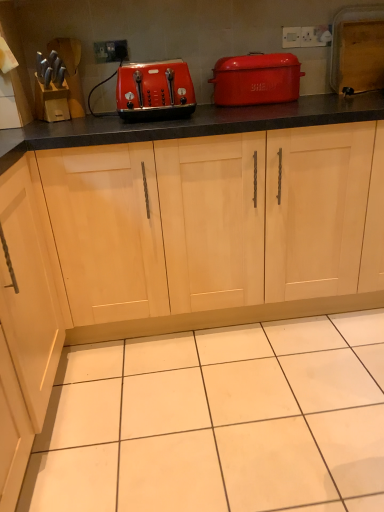
Question: From a real-world perspective, is light wood cabinet at center physically above matte red bread bin at upper center?

Choices:
 (A) no
 (B) yes

Answer: (A)

Question: Can you confirm if light wood cabinet at center is wider than matte red bread bin at upper center?

Choices:
 (A) no
 (B) yes

Answer: (B)

Question: Is the surface of light wood cabinet at center in direct contact with matte red bread bin at upper center?

Choices:
 (A) no
 (B) yes

Answer: (A)

Question: Are light wood cabinet at center and matte red bread bin at upper center far apart?

Choices:
 (A) yes
 (B) no

Answer: (B)

Question: From the image's perspective, would you say light wood cabinet at center is shown under matte red bread bin at upper center?

Choices:
 (A) yes
 (B) no

Answer: (A)

Question: Considering the relative positions of light wood cabinet at center and matte red bread bin at upper center in the image provided, is light wood cabinet at center to the left of matte red bread bin at upper center from the viewer's perspective?

Choices:
 (A) yes
 (B) no

Answer: (A)

Question: Could you tell me if white plastic electric outlet at upper center is turned towards matte red bread bin at upper center?

Choices:
 (A) no
 (B) yes

Answer: (A)

Question: From a real-world perspective, is white plastic electric outlet at upper center located higher than matte red bread bin at upper center?

Choices:
 (A) no
 (B) yes

Answer: (B)

Question: From a real-world perspective, is white plastic electric outlet at upper center positioned under matte red bread bin at upper center based on gravity?

Choices:
 (A) no
 (B) yes

Answer: (A)

Question: Is white plastic electric outlet at upper center in front of matte red bread bin at upper center?

Choices:
 (A) no
 (B) yes

Answer: (A)

Question: Can you confirm if white plastic electric outlet at upper center is positioned to the right of matte red bread bin at upper center?

Choices:
 (A) no
 (B) yes

Answer: (A)

Question: Is white plastic electric outlet at upper center next to matte red bread bin at upper center?

Choices:
 (A) no
 (B) yes

Answer: (A)

Question: Is white plastic electric outlet at upper center oriented away from matte plastic toaster at center?

Choices:
 (A) yes
 (B) no

Answer: (B)